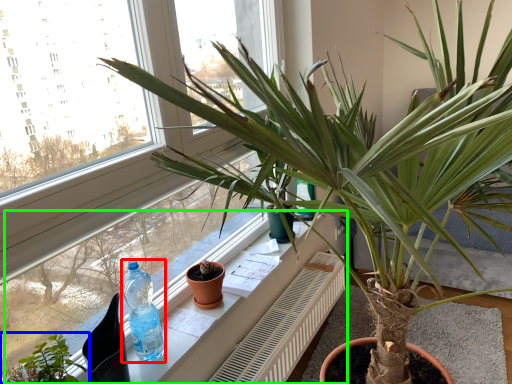
Question: Which object is positioned farthest from bottle (highlighted by a red box)? Select from houseplant (highlighted by a blue box) and window sill (highlighted by a green box).

Choices:
 (A) houseplant
 (B) window sill

Answer: (A)